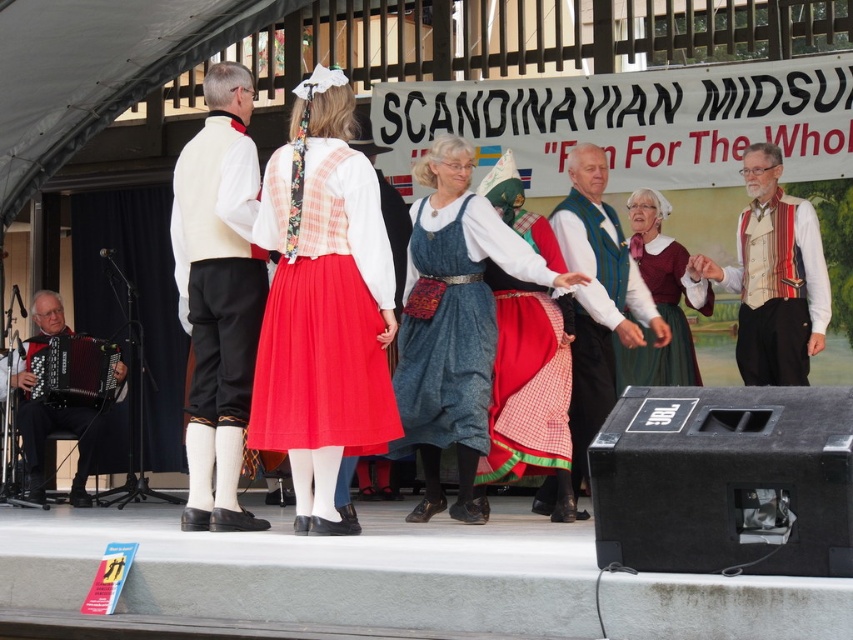
From the picture: Which of these two, matte red skirt at center or black leather accordion at left, stands shorter?

With less height is matte red skirt at center.

Can you confirm if matte red skirt at center is thinner than black leather accordion at left?

Yes, matte red skirt at center is thinner than black leather accordion at left.

Is point (650, 369) positioned in front of point (27, 428)?

Yes, it is in front of point (27, 428).

You are a GUI agent. You are given a task and a screenshot of the screen. Output one action in this format:
    pyautogui.click(x=<x>, y=<y>)
    Task: Click on the matte red skirt at center
    The width and height of the screenshot is (853, 640).
    Given the screenshot: What is the action you would take?
    (657, 300)

Is point (212, 353) less distant than point (630, 365)?

Yes, it is in front of point (630, 365).

Which is above, white cotton vest at center or matte red skirt at center?

matte red skirt at center

Between point (186, 205) and point (692, 342), which one is positioned behind?

The point (692, 342) is behind.

Where is `white cotton vest at center`? Image resolution: width=853 pixels, height=640 pixels. white cotton vest at center is located at coordinates (218, 296).

Who is more forward, (322, 122) or (606, 221)?

Point (322, 122) is in front.

Measure the distance between point (285,362) and camera.

25.91 feet

Locate an element on the screen. This screenshot has height=640, width=853. matte white blouse at center is located at coordinates (323, 305).